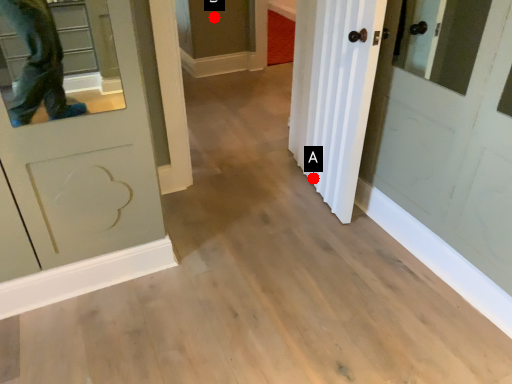
Question: Two points are circled on the image, labeled by A and B beside each circle. Which point is farther to the camera?

Choices:
 (A) A is further
 (B) B is further

Answer: (B)